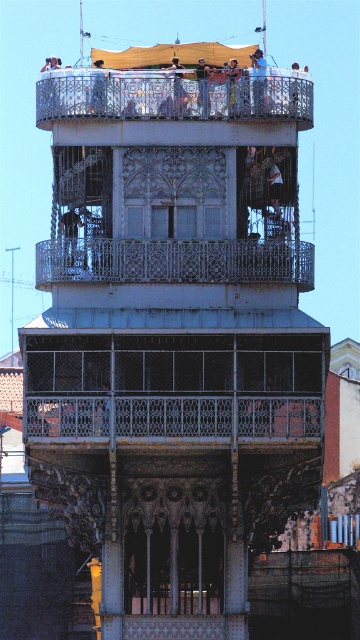
Is metallic silver balcony at center closer to camera compared to matte black person at upper center?

Yes, metallic silver balcony at center is closer to the viewer.

Find the location of a particular element. The width and height of the screenshot is (360, 640). metallic silver balcony at center is located at coordinates (173, 385).

Between silver metallic balcony at upper center and smooth skin person at upper center, which one is positioned lower?

smooth skin person at upper center is lower down.

Who is positioned more to the left, silver metallic balcony at upper center or smooth skin person at upper center?

Positioned to the left is silver metallic balcony at upper center.

Where is `silver metallic balcony at upper center`? The width and height of the screenshot is (360, 640). silver metallic balcony at upper center is located at coordinates (169, 97).

Can you confirm if silver metallic balcony at upper center is taller than light brown wooden bench at upper center?

Yes, silver metallic balcony at upper center is taller than light brown wooden bench at upper center.

Which is in front, point (295, 92) or point (203, 84)?

Point (203, 84) is more forward.

Identify the location of silver metallic balcony at upper center. The width and height of the screenshot is (360, 640). (169, 97).